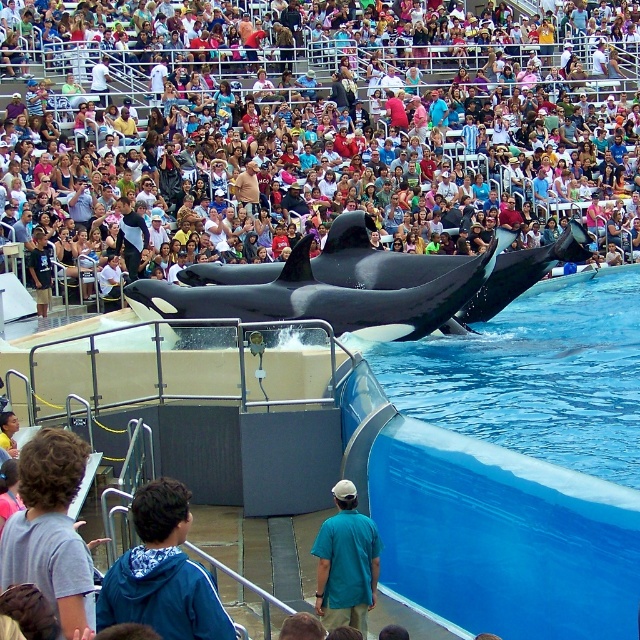
You are a photographer standing at the origin point of the image coordinate system. You want to take a photo of the multicolored fabric crowd at upper center. What are the coordinates where you should aim your camera?

The coordinates to aim the camera are at point (x=333, y=129).

You are a photographer standing at the front row of the bleachers. You want to take a picture of the black smooth orca at center. Based on its position, where should you aim your camera to capture it best?

You should aim your camera at the coordinates point (364, 285) to capture the black smooth orca at center effectively.